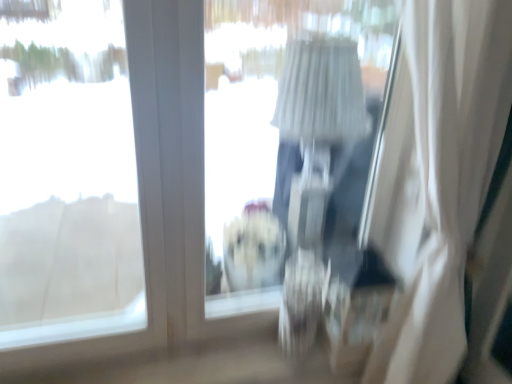
The height and width of the screenshot is (384, 512). What do you see at coordinates (275, 136) in the screenshot?
I see `transparent plastic window screen at center` at bounding box center [275, 136].

Consider the image. In order to face white sheer curtain at right, should I rotate leftwards or rightwards?

You should rotate right by 18.961 degrees.

Image resolution: width=512 pixels, height=384 pixels. Describe the element at coordinates (67, 175) in the screenshot. I see `transparent glass window at upper left` at that location.

The height and width of the screenshot is (384, 512). In order to click on transparent plastic window screen at center in this screenshot , I will do `click(275, 136)`.

Consider the image. From a real-world perspective, is transparent glass window at upper left positioned over transparent plastic window screen at center based on gravity?

Incorrect, from a real-world perspective, transparent glass window at upper left is lower than transparent plastic window screen at center.

Is transparent glass window at upper left closer to camera compared to transparent plastic window screen at center?

Yes, transparent glass window at upper left is closer to the viewer.

Does point (30, 47) appear closer or farther from the camera than point (297, 170)?

Point (30, 47) is positioned farther from the camera compared to point (297, 170).

What's the angular difference between transparent glass window at upper left and transparent plastic window screen at center's facing directions?

There is a 0.772-degree angle between the facing directions of transparent glass window at upper left and transparent plastic window screen at center.

Is transparent glass window at upper left taller or shorter than white sheer curtain at right?

Clearly, transparent glass window at upper left is shorter compared to white sheer curtain at right.

Which of these two, transparent glass window at upper left or white sheer curtain at right, is smaller?

transparent glass window at upper left is smaller.

Which object is closer to the camera taking this photo, transparent glass window at upper left or white sheer curtain at right?

white sheer curtain at right is more forward.

Is transparent plastic window screen at center wider than transparent glass window at upper left?

No, transparent plastic window screen at center is not wider than transparent glass window at upper left.

Is transparent plastic window screen at center oriented away from transparent glass window at upper left?

No, transparent plastic window screen at center's orientation is not away from transparent glass window at upper left.

Is transparent plastic window screen at center smaller than transparent glass window at upper left?

Correct, transparent plastic window screen at center occupies less space than transparent glass window at upper left.

This screenshot has height=384, width=512. In the image, there is a transparent plastic window screen at center. Find the location of `window below it (from the image's perspective)`. window below it (from the image's perspective) is located at coordinates (67, 175).

Where is `curtain on the right of transparent glass window at upper left`? curtain on the right of transparent glass window at upper left is located at coordinates (x=437, y=177).

What's the angular difference between white sheer curtain at right and transparent glass window at upper left's facing directions?

There is a 5.29-degree angle between the facing directions of white sheer curtain at right and transparent glass window at upper left.

Looking at this image, from a real-world perspective, is white sheer curtain at right located beneath transparent glass window at upper left?

Yes.

From the image's perspective, relative to transparent glass window at upper left, is white sheer curtain at right above or below?

From the image's perspective, white sheer curtain at right appears below transparent glass window at upper left.

From a real-world perspective, is transparent plastic window screen at center under white sheer curtain at right?

Actually, transparent plastic window screen at center is physically above white sheer curtain at right in the real world.

Could you tell me if transparent plastic window screen at center is facing white sheer curtain at right?

Yes.

Considering the sizes of objects transparent plastic window screen at center and white sheer curtain at right in the image provided, who is taller, transparent plastic window screen at center or white sheer curtain at right?

white sheer curtain at right.

Between transparent plastic window screen at center and white sheer curtain at right, which one has larger size?

white sheer curtain at right.

Considering their positions, is white sheer curtain at right located in front of or behind transparent plastic window screen at center?

white sheer curtain at right is in front of transparent plastic window screen at center.

Considering the sizes of white sheer curtain at right and transparent plastic window screen at center in the image, is white sheer curtain at right taller or shorter than transparent plastic window screen at center?

Considering their sizes, white sheer curtain at right has more height than transparent plastic window screen at center.

Is white sheer curtain at right at the left side of transparent plastic window screen at center?

No.

I want to click on window screen above the transparent glass window at upper left (from the image's perspective), so click(275, 136).

The image size is (512, 384). Identify the location of curtain in front of the transparent glass window at upper left. (437, 177).

When comparing their distances from transparent glass window at upper left, does white sheer curtain at right or transparent plastic window screen at center seem further?

white sheer curtain at right is further to transparent glass window at upper left.

Consider the image. Considering their positions, is transparent plastic window screen at center positioned further to transparent glass window at upper left than white sheer curtain at right?

Based on the image, white sheer curtain at right appears to be further to transparent glass window at upper left.

From the image, which object appears to be farther from transparent plastic window screen at center, transparent glass window at upper left or white sheer curtain at right?

white sheer curtain at right is positioned further to the anchor transparent plastic window screen at center.

Estimate the real-world distances between objects in this image. Which object is closer to transparent plastic window screen at center, white sheer curtain at right or transparent glass window at upper left?

transparent glass window at upper left.

Looking at this image, based on their spatial positions, is transparent glass window at upper left or transparent plastic window screen at center further from white sheer curtain at right?

transparent glass window at upper left is positioned further to the anchor white sheer curtain at right.

Which object lies further to the anchor point white sheer curtain at right, transparent plastic window screen at center or transparent glass window at upper left?

The object further to white sheer curtain at right is transparent glass window at upper left.

At what (x,y) coordinates should I click in order to perform the action: click on window screen located between transparent glass window at upper left and white sheer curtain at right in the left-right direction. Please return your answer as a coordinate pair (x, y). The height and width of the screenshot is (384, 512). Looking at the image, I should click on (275, 136).